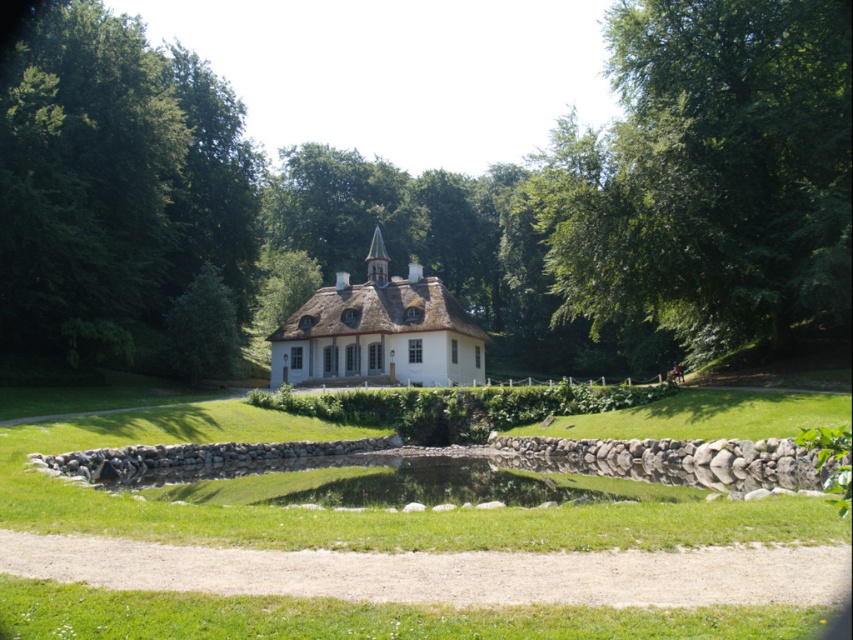
Which is behind, point (573, 291) or point (608, 234)?

Positioned behind is point (573, 291).

Between green leafy tree at center and green leafy tree at upper right, which one appears on the right side from the viewer's perspective?

Positioned to the right is green leafy tree at upper right.

Where is `green leafy tree at center`? Image resolution: width=853 pixels, height=640 pixels. green leafy tree at center is located at coordinates (444, 192).

Locate an element on the screen. The height and width of the screenshot is (640, 853). green leafy tree at center is located at coordinates (444, 192).

How distant is green leafy tree at center from green grassy pond at center?

The distance of green leafy tree at center from green grassy pond at center is 115.83 feet.

Does green leafy tree at center appear under green grassy pond at center?

No.

Find the location of a particular element. Image resolution: width=853 pixels, height=640 pixels. green leafy tree at center is located at coordinates (444, 192).

Can you confirm if green leafy tree at center is positioned above green leafy tree at upper left?

Yes.

Identify the location of green leafy tree at center. Image resolution: width=853 pixels, height=640 pixels. (444, 192).